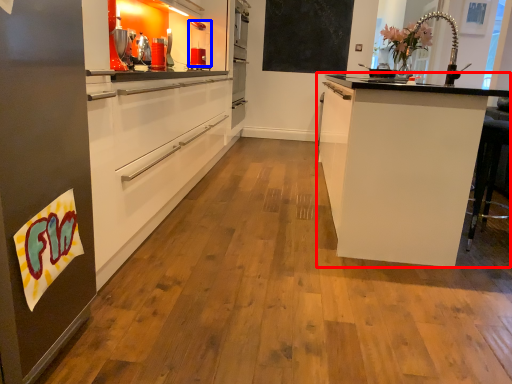
Question: Among these objects, which one is nearest to the camera, cabinetry (highlighted by a red box) or kitchen appliance (highlighted by a blue box)?

Choices:
 (A) cabinetry
 (B) kitchen appliance

Answer: (A)